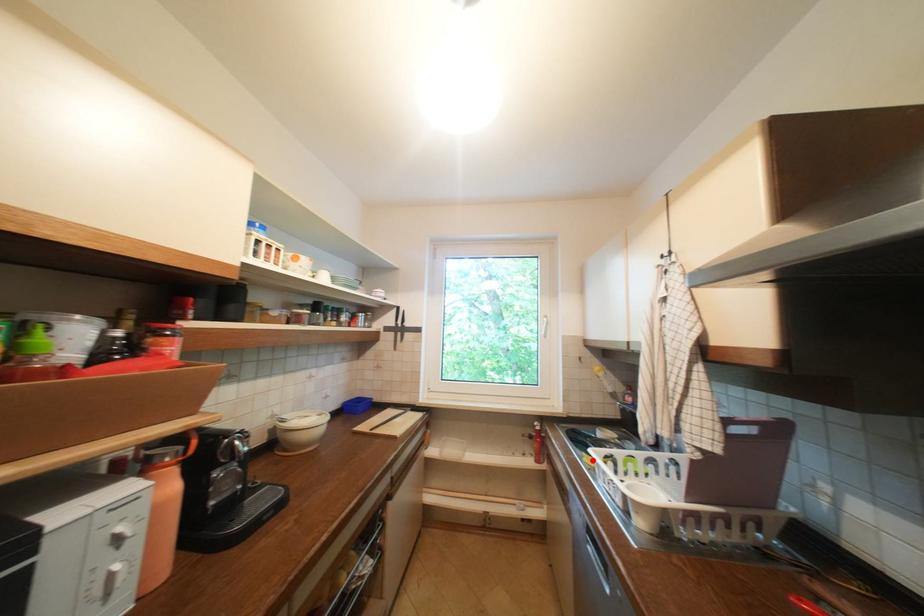
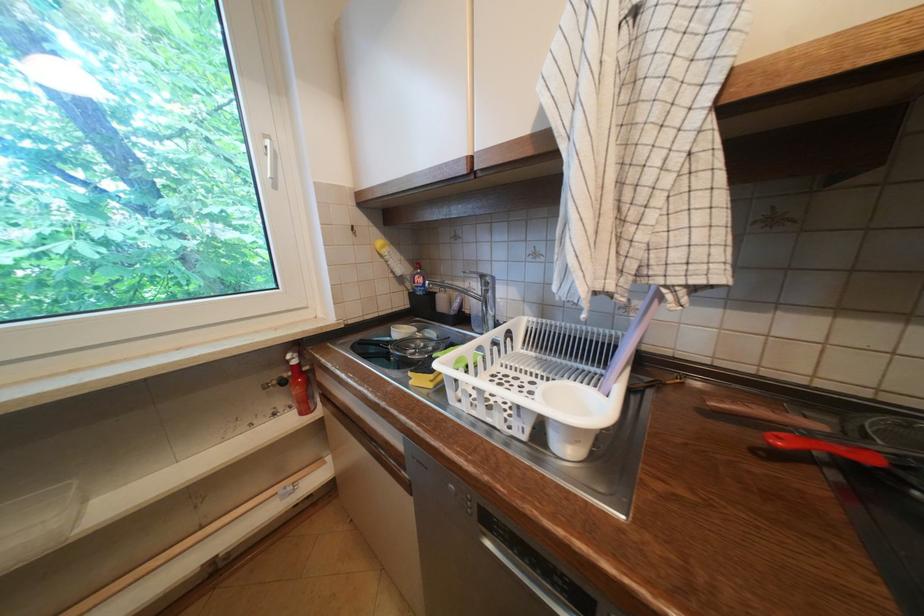
Question: I am providing you with two images of the same scene from different viewpoints. A red point is shown in image1. For the corresponding object point in image2, is it positioned nearer or farther from the camera?

Choices:
 (A) Nearer
 (B) Farther

Answer: (B)